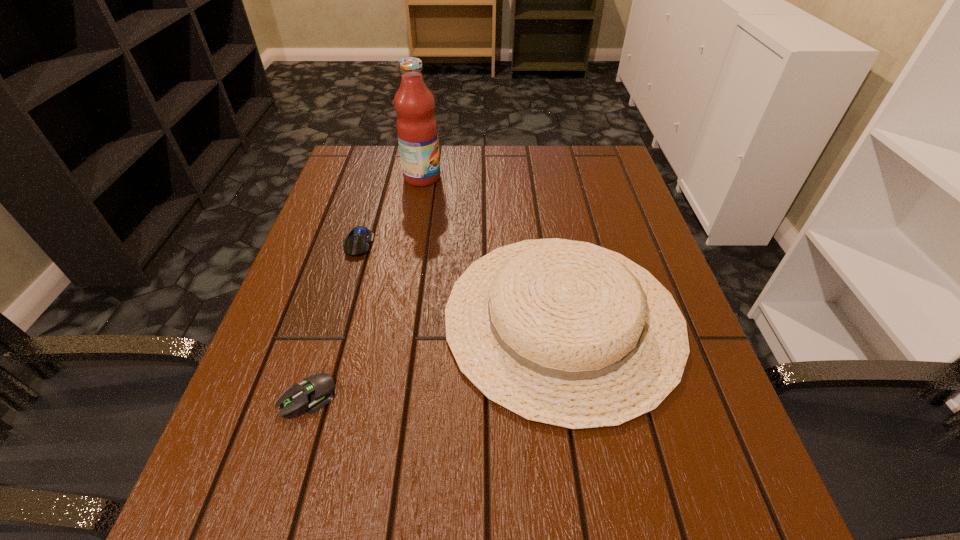
This screenshot has width=960, height=540. In order to click on free space that satisfies the following two spatial constraints: 1. on the front label of the rightmost object; 2. on the left side of the fruit juice in this screenshot , I will do `click(398, 319)`.

This screenshot has width=960, height=540. In order to click on free space that satisfies the following two spatial constraints: 1. on the button side of the farther computer mouse; 2. on the right side of the third shortest object in this screenshot , I will do `click(336, 319)`.

Find the location of a particular element. The image size is (960, 540). free space that satisfies the following two spatial constraints: 1. on the front label of the third shortest object; 2. on the left side of the third object from left to right is located at coordinates pos(398,319).

Image resolution: width=960 pixels, height=540 pixels. Find the location of `free space that satisfies the following two spatial constraints: 1. on the front label of the tallest object; 2. on the button side of the farther computer mouse`. free space that satisfies the following two spatial constraints: 1. on the front label of the tallest object; 2. on the button side of the farther computer mouse is located at coordinates (411, 244).

Where is `free space that satisfies the following two spatial constraints: 1. on the button side of the rightmost object; 2. on the right side of the farther computer mouse`? The height and width of the screenshot is (540, 960). free space that satisfies the following two spatial constraints: 1. on the button side of the rightmost object; 2. on the right side of the farther computer mouse is located at coordinates pos(336,319).

This screenshot has height=540, width=960. Identify the location of blank area in the image that satisfies the following two spatial constraints: 1. on the front label of the third shortest object; 2. on the right side of the farthest object. (398, 319).

Locate an element on the screen. vacant space that satisfies the following two spatial constraints: 1. on the front label of the farthest object; 2. on the left side of the second tallest object is located at coordinates (398, 319).